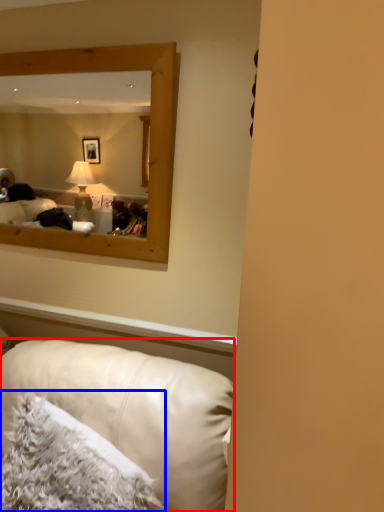
Question: Which point is further to the camera, studio couch (highlighted by a red box) or pillow (highlighted by a blue box)?

Choices:
 (A) studio couch
 (B) pillow

Answer: (B)